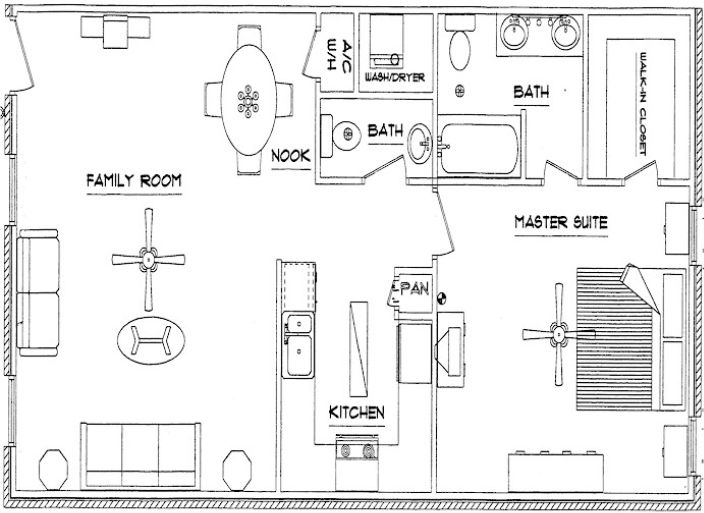
What are the coordinates of `stove` in the screenshot? It's located at (350, 463).